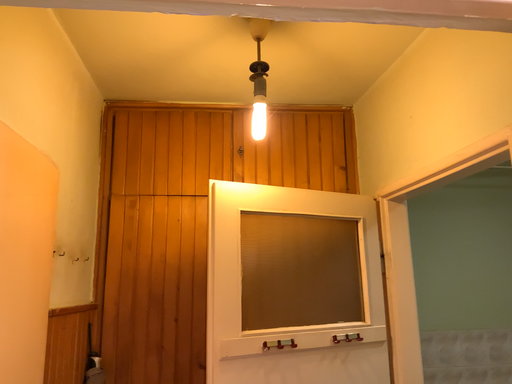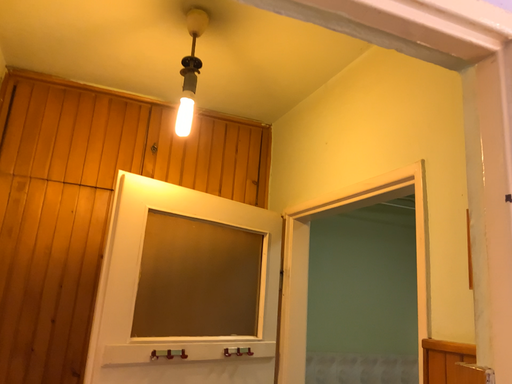
Question: How did the camera likely rotate when shooting the video?

Choices:
 (A) rotated right
 (B) rotated left

Answer: (A)